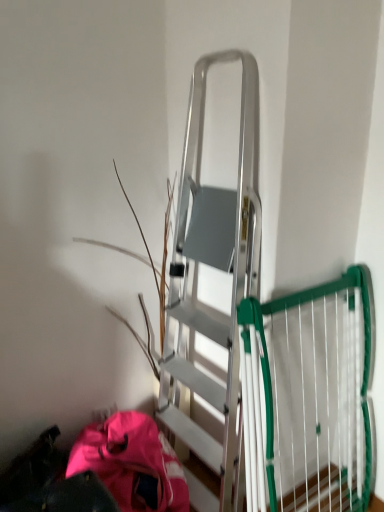
The height and width of the screenshot is (512, 384). Describe the element at coordinates (132, 463) in the screenshot. I see `pink fabric bag at lower left` at that location.

Identify the location of pink fabric bag at lower left. The height and width of the screenshot is (512, 384). (132, 463).

Find the location of `pink fabric bag at lower left`. pink fabric bag at lower left is located at coordinates (132, 463).